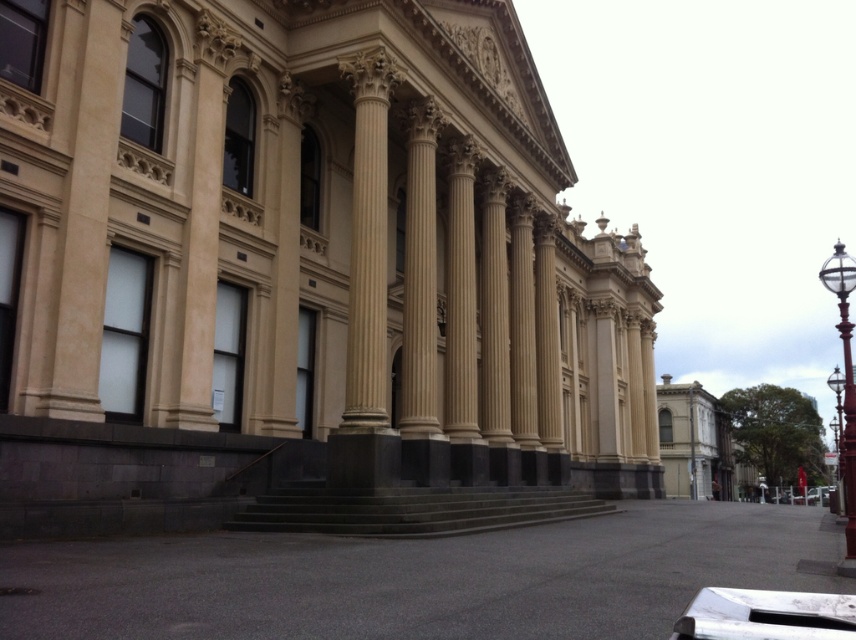
Is polished brass streetlamp at right positioned before polished brass lamp post at right?

Yes, polished brass streetlamp at right is in front of polished brass lamp post at right.

Between polished brass streetlamp at right and polished brass lamp post at right, which one appears on the right side from the viewer's perspective?

From the viewer's perspective, polished brass lamp post at right appears more on the right side.

Between point (847, 260) and point (842, 384), which one is positioned in front?

Point (847, 260) is more forward.

In order to click on polished brass streetlamp at right in this screenshot , I will do point(843,381).